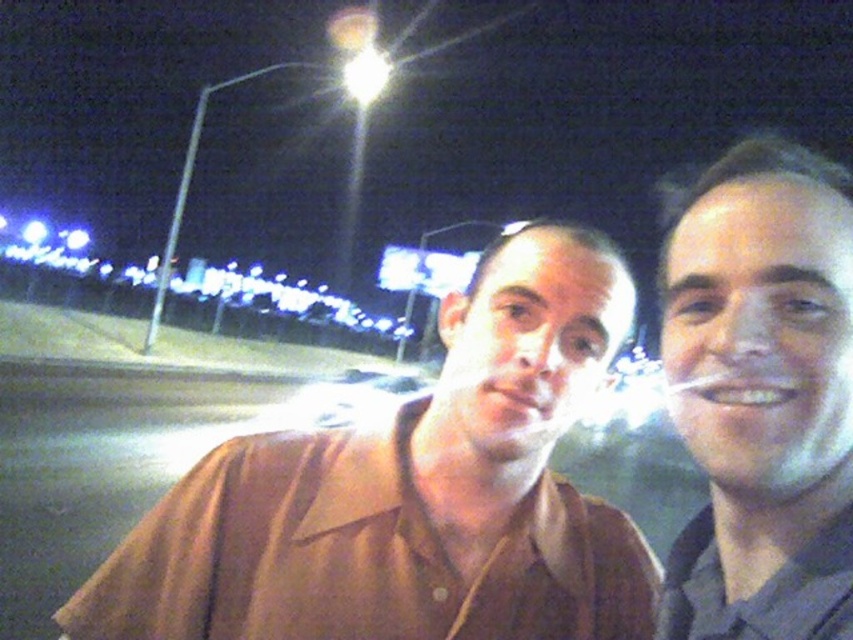
You are a photographer trying to capture a clear photo of both the brown shirt at center and the gray matte face at right. Since the camera can only focus on one subject at a time, which subject should you choose to ensure the other remains in the background?

You should focus on the brown shirt at center because it is closer to the viewer than the gray matte face at right, so focusing on the closer subject will keep the farther one in the background.

You are a photographer setting up a tripod to capture the two subjects in the scene. The brown shirt at center and the gray matte face at right must both be in frame. Given that the maximum width of your camera lens is 1.2 meters, can you confirm if both subjects can fit within the frame without moving the tripod?

The brown shirt at center might be wider than gray matte face at right, but since the maximum width of the camera lens is 1.2 meters, it is possible that both subjects can fit within the frame if their combined width does not exceed 1.2 meters. However, without exact measurements, this cannot be confirmed definitively.

You are a photographer trying to capture a portrait of both the brown shirt at center and the gray matte face at right. Since you want both subjects to appear balanced in the frame, which subject should you position closer to the camera?

The gray matte face at right should be positioned closer to the camera because the brown shirt at center has a greater height compared to gray matte face at right, so moving the shorter subject forward can help balance their apparent sizes in the photo.